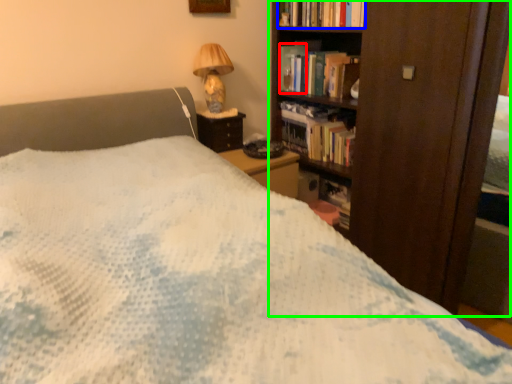
Question: Which is farther away from paperback book (highlighted by a red box)? book (highlighted by a blue box) or bookcase (highlighted by a green box)?

Choices:
 (A) book
 (B) bookcase

Answer: (B)